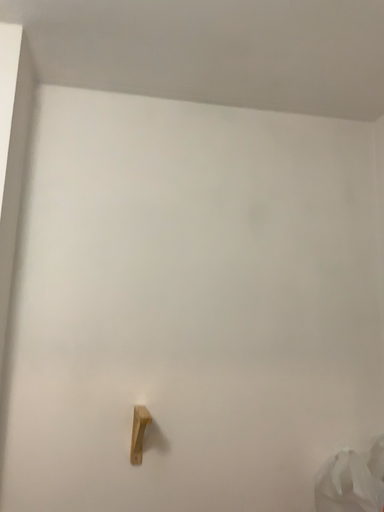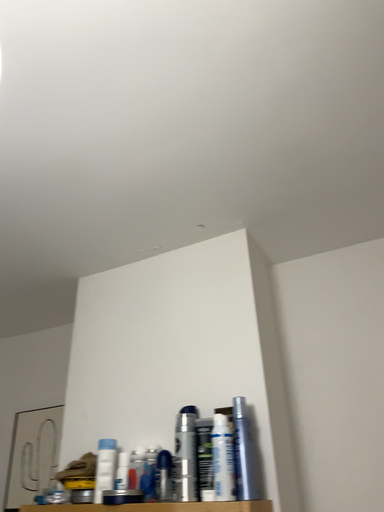
Question: How did the camera likely rotate when shooting the video?

Choices:
 (A) rotated right
 (B) rotated left

Answer: (B)